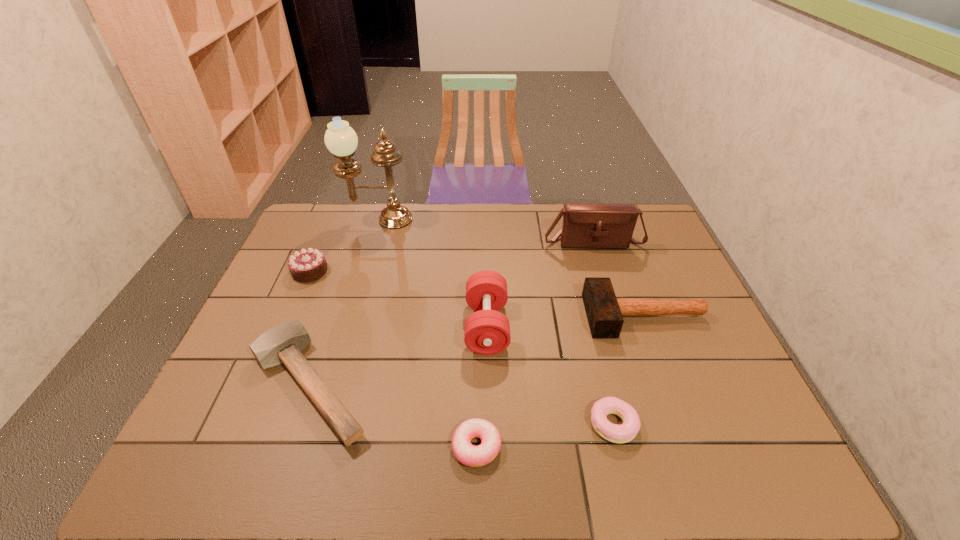
Where is `oil lamp that is at the far edge`? The height and width of the screenshot is (540, 960). oil lamp that is at the far edge is located at coordinates (340, 139).

Locate an element on the screen. The image size is (960, 540). shoulder bag at the far edge is located at coordinates (585, 225).

You are a GUI agent. You are given a task and a screenshot of the screen. Output one action in this format:
    pyautogui.click(x=<x>, y=<y>)
    Task: Click on the mallet situated at the near edge
    This screenshot has width=960, height=540.
    Given the screenshot: What is the action you would take?
    pyautogui.click(x=283, y=344)

This screenshot has width=960, height=540. What are the coordinates of `oil lamp situated at the left edge` in the screenshot? It's located at [340, 139].

Where is `chocolate cake located at the left edge`? This screenshot has height=540, width=960. chocolate cake located at the left edge is located at coordinates (307, 265).

Where is `mallet that is at the left edge`? This screenshot has width=960, height=540. mallet that is at the left edge is located at coordinates (283, 344).

This screenshot has height=540, width=960. In order to click on shoulder bag present at the right edge in this screenshot , I will do `click(585, 225)`.

You are a GUI agent. You are given a task and a screenshot of the screen. Output one action in this format:
    pyautogui.click(x=<x>, y=<y>)
    Task: Click on the mallet that is at the right edge
    Image resolution: width=960 pixels, height=540 pixels.
    Given the screenshot: What is the action you would take?
    pyautogui.click(x=604, y=311)

Where is `object at the far left corner`? object at the far left corner is located at coordinates (340, 139).

The image size is (960, 540). In order to click on object positioned at the near left corner in this screenshot , I will do `click(283, 344)`.